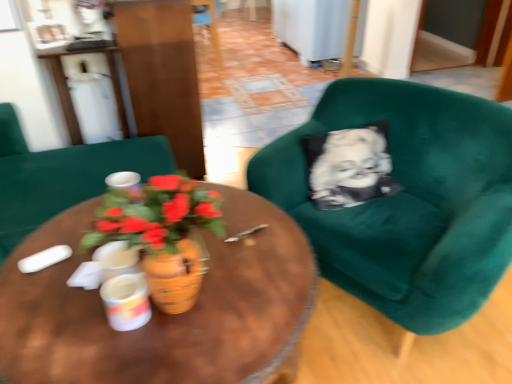
Image resolution: width=512 pixels, height=384 pixels. Identify the location of vacant region in front of white glossy coffee cup at center, placed as the first coffee cup when sorted from front to back. (122, 357).